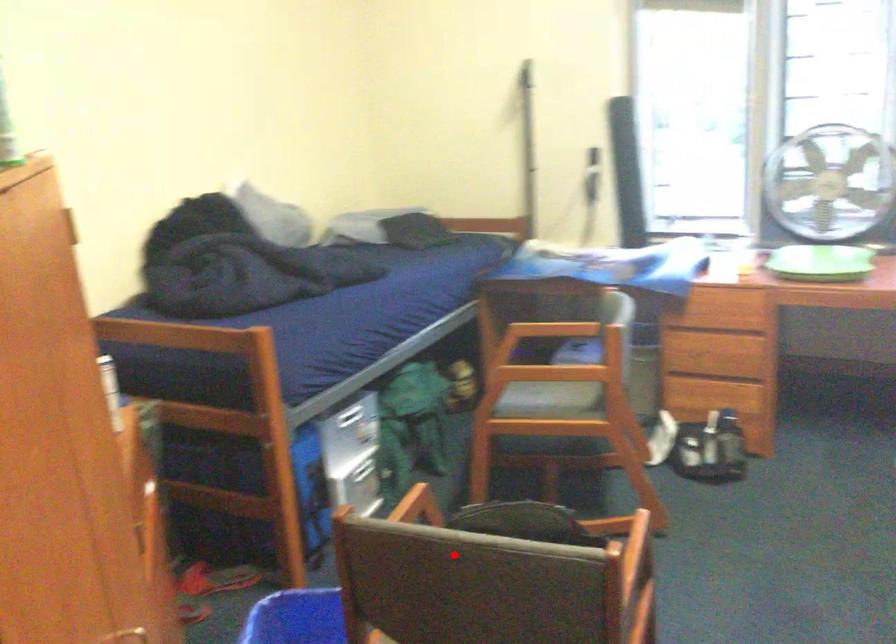
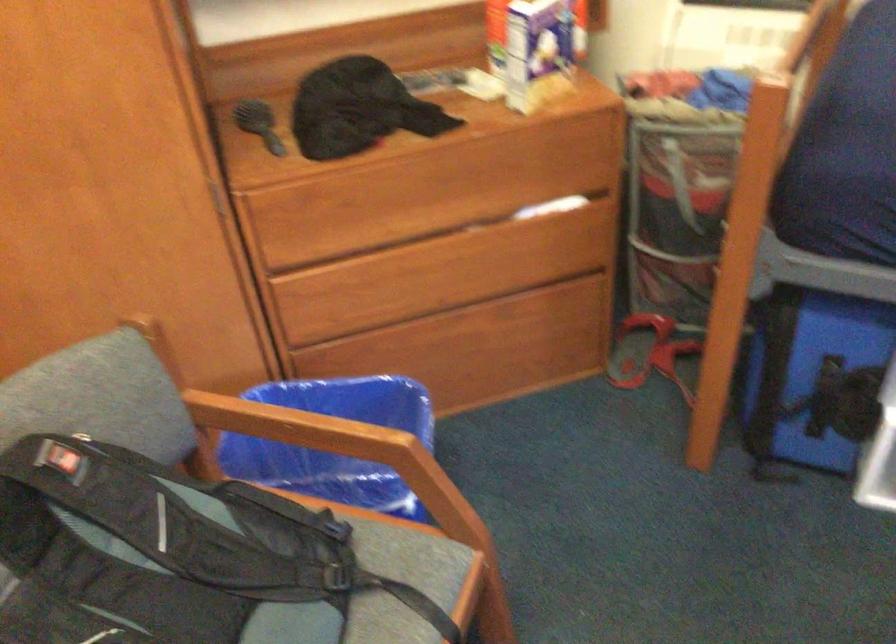
In the second image, find the point that corresponds to the highlighted location in the first image.

(162, 543)